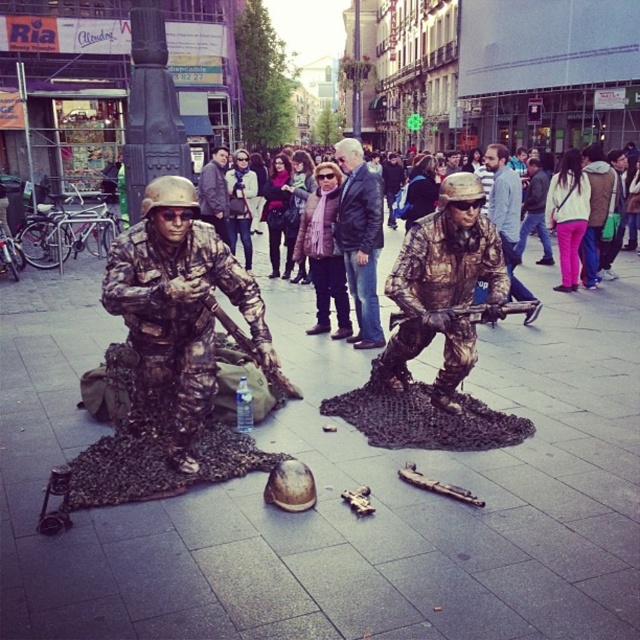
You are a city planner who needs to install a new streetlight between the camouflage fabric soldier at center and the brushed metal helmet at center. The streetlight requires a minimum of 20 feet of space between the two objects to be safely installed. Based on the distance provided, can the streetlight be placed between them?

The camouflage fabric soldier at center is 19.34 feet away from the brushed metal helmet at center. Since the required minimum space is 20 feet, the streetlight cannot be safely installed between them as the distance is insufficient.

Based on the photo, you are a city planner analyzing the urban street scene. You notice a point at coordinates (508, 220). What object is located at this point?

The point at coordinates (508, 220) corresponds to the camouflage fabric soldier at center.